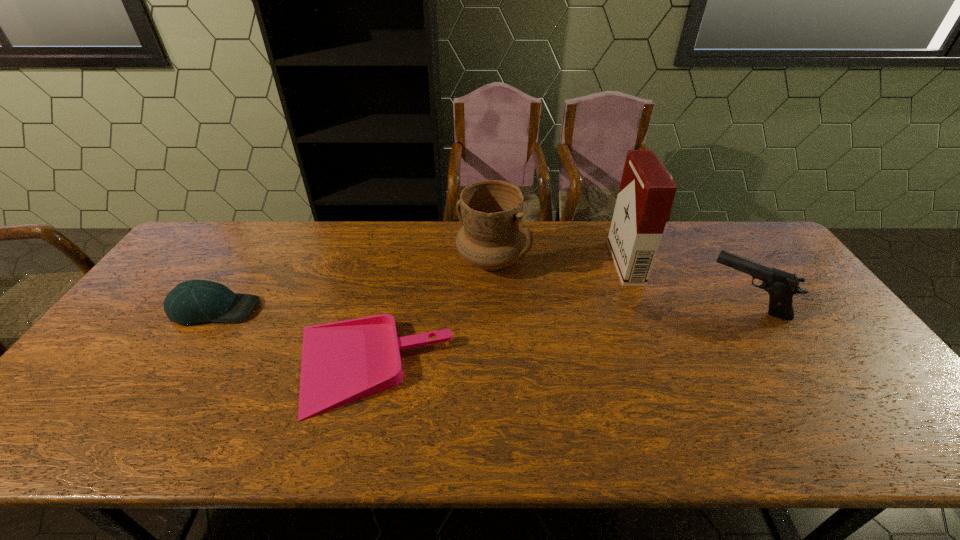
You are a GUI agent. You are given a task and a screenshot of the screen. Output one action in this format:
    pyautogui.click(x=<x>, y=<y>)
    Task: Click on the object that stands as the second closest to the tallest object
    The height and width of the screenshot is (540, 960).
    Given the screenshot: What is the action you would take?
    pyautogui.click(x=493, y=235)